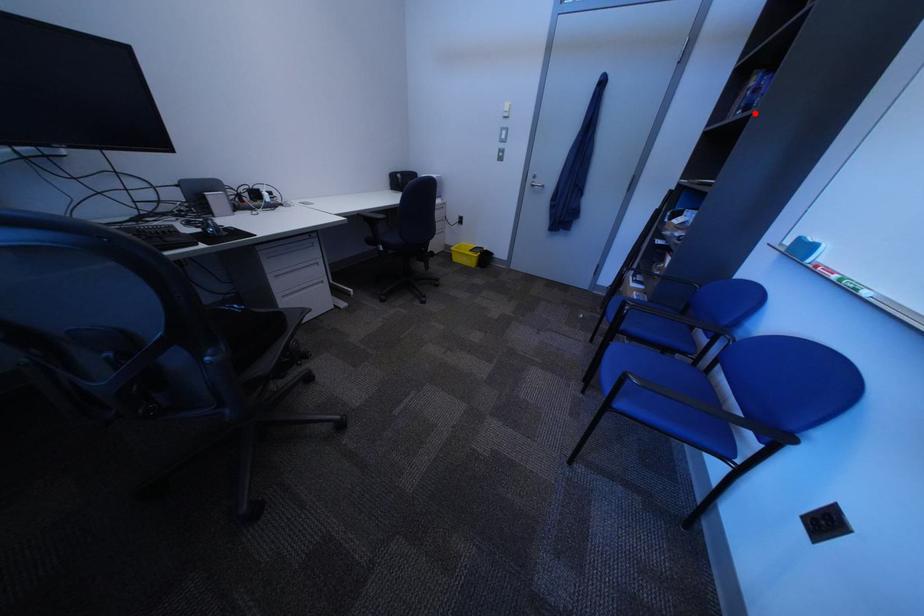
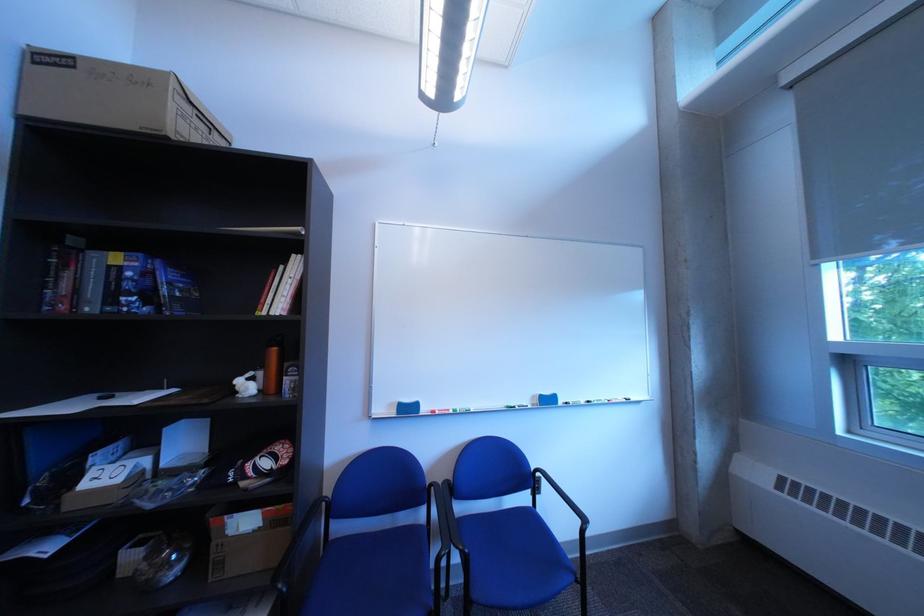
Find the pixel in the second image that matches the highlighted location in the first image.

(150, 300)